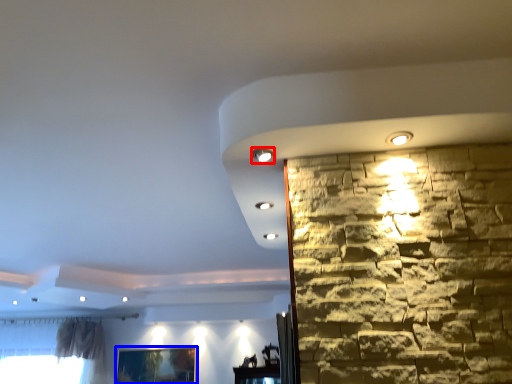
Question: Which of the following is the farthest to the observer, light (highlighted by a red box) or picture frame (highlighted by a blue box)?

Choices:
 (A) light
 (B) picture frame

Answer: (B)